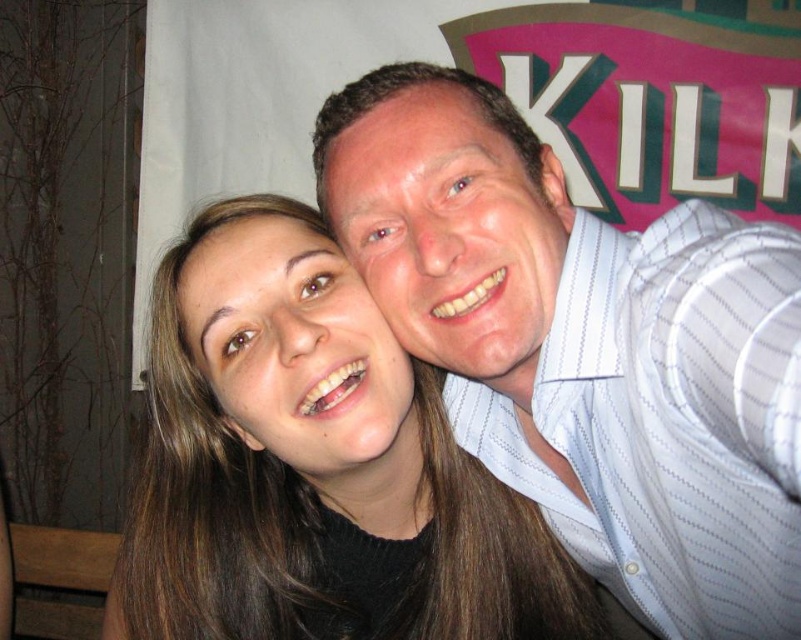
Question: Which object appears closest to the camera in this image?

Choices:
 (A) brown hair at center
 (B) white striped shirt at upper right

Answer: (B)

Question: Is white striped shirt at upper right above brown hair at center?

Choices:
 (A) yes
 (B) no

Answer: (A)

Question: Which object appears farthest from the camera in this image?

Choices:
 (A) brown hair at center
 (B) white striped shirt at upper right

Answer: (A)

Question: In this image, where is white striped shirt at upper right located relative to brown hair at center?

Choices:
 (A) below
 (B) above

Answer: (B)

Question: Which point is farther to the camera?

Choices:
 (A) white striped shirt at upper right
 (B) brown hair at center

Answer: (B)

Question: Can you confirm if white striped shirt at upper right is positioned to the left of brown hair at center?

Choices:
 (A) yes
 (B) no

Answer: (B)